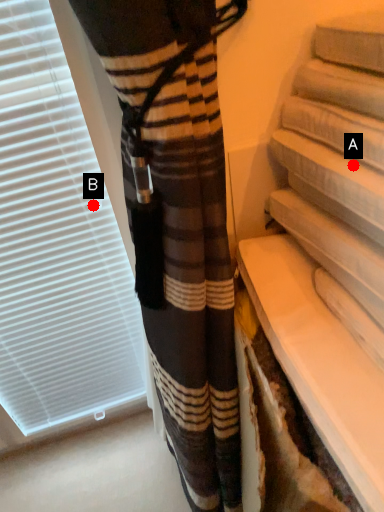
Question: Two points are circled on the image, labeled by A and B beside each circle. Which of the following is the closest to the observer?

Choices:
 (A) A is closer
 (B) B is closer

Answer: (A)